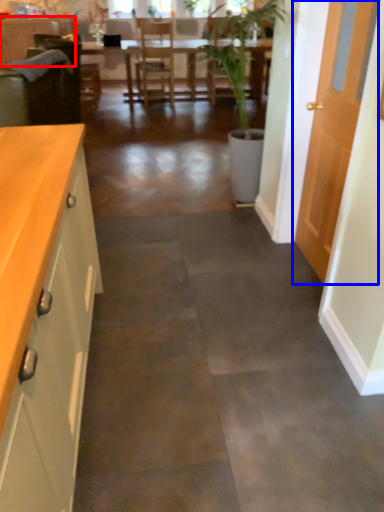
Question: Which of the following is the farthest to the observer, cabinetry (highlighted by a red box) or door (highlighted by a blue box)?

Choices:
 (A) cabinetry
 (B) door

Answer: (A)